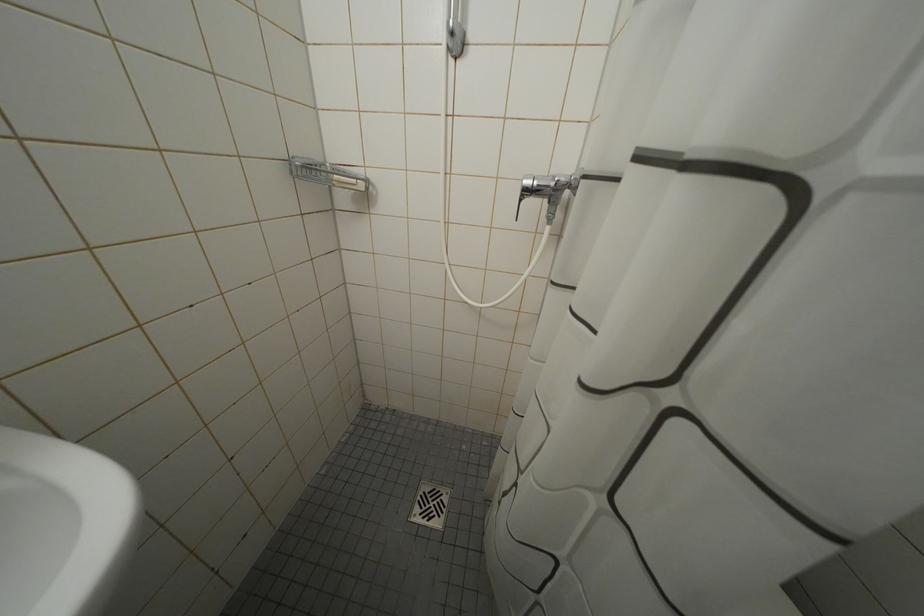
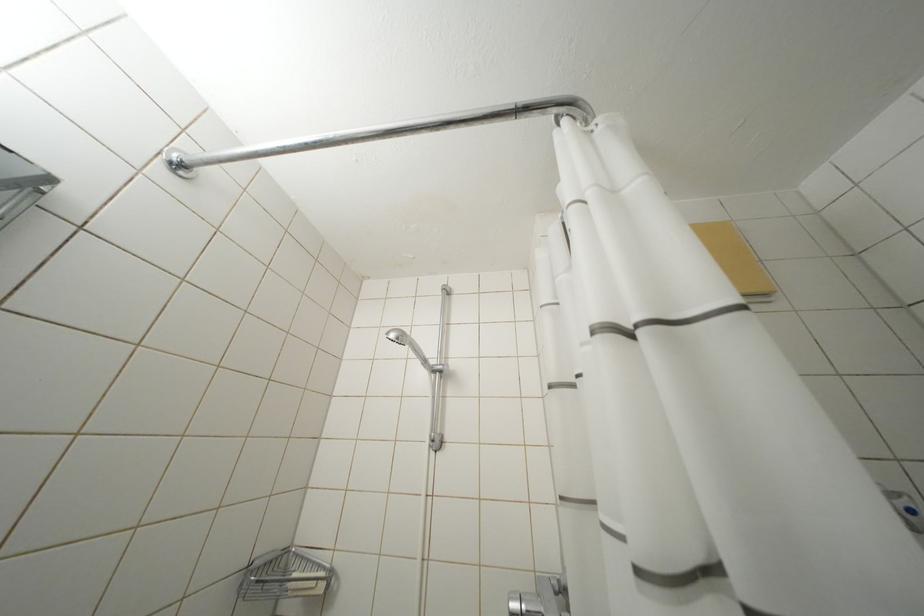
Question: The images are taken continuously from a first-person perspective. In which direction is your viewpoint rotating?

Choices:
 (A) Left
 (B) Right
 (C) Up
 (D) Down

Answer: (C)